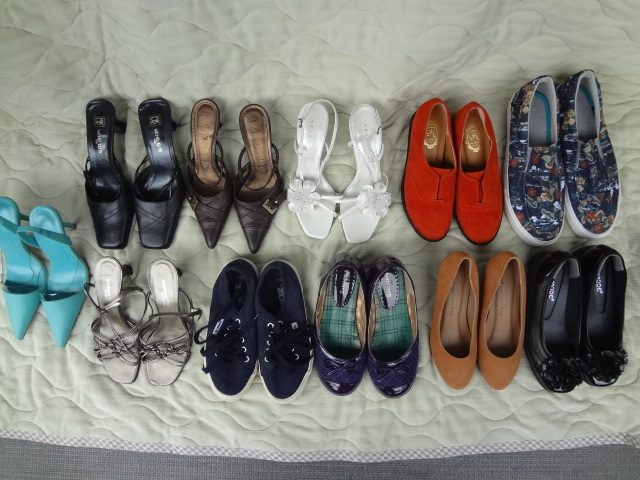
Image resolution: width=640 pixels, height=480 pixels. What are the coordinates of `shoe pairs in top row` in the screenshot? It's located at (143, 186), (218, 187), (320, 186), (422, 186), (534, 183).